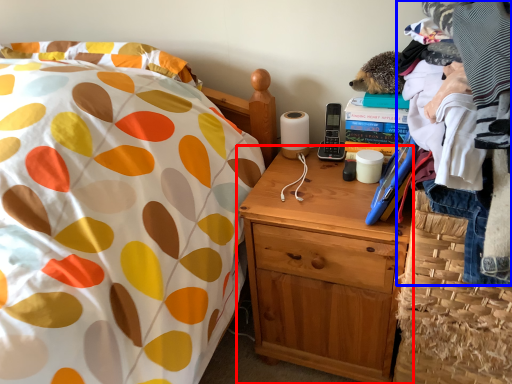
Question: Which object appears farthest to the camera in this image, nightstand (highlighted by a red box) or clothing (highlighted by a blue box)?

Choices:
 (A) nightstand
 (B) clothing

Answer: (A)